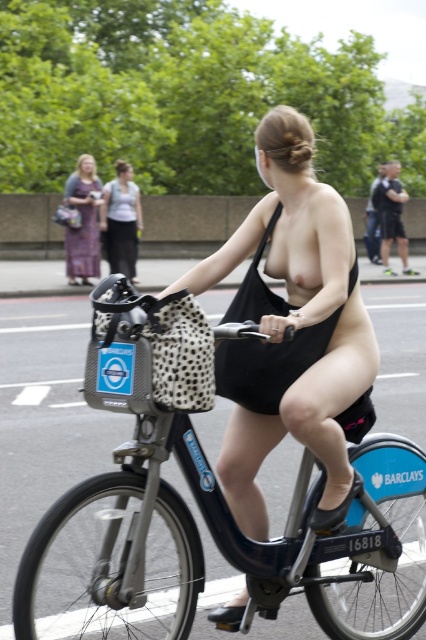
Question: Which of the following is the farthest from the observer?

Choices:
 (A) metallic blue bicycle at center
 (B) black matte bikini top at center
 (C) black fabric bandeau at upper center
 (D) black matte dress at center

Answer: (C)

Question: Does white shirt at upper center lie in front of printed fabric dress at left?

Choices:
 (A) yes
 (B) no

Answer: (B)

Question: Is black matte dress at center above printed fabric dress at left?

Choices:
 (A) no
 (B) yes

Answer: (A)

Question: Which point is closer to the camera?

Choices:
 (A) black fabric bandeau at upper center
 (B) printed fabric dress at left
 (C) black matte bikini top at center

Answer: (C)

Question: Is white shirt at upper center positioned before black fabric bandeau at upper center?

Choices:
 (A) no
 (B) yes

Answer: (B)

Question: Which of these objects is positioned closest to the black fabric bandeau at upper center?

Choices:
 (A) printed fabric dress at left
 (B) white shirt at upper center

Answer: (B)